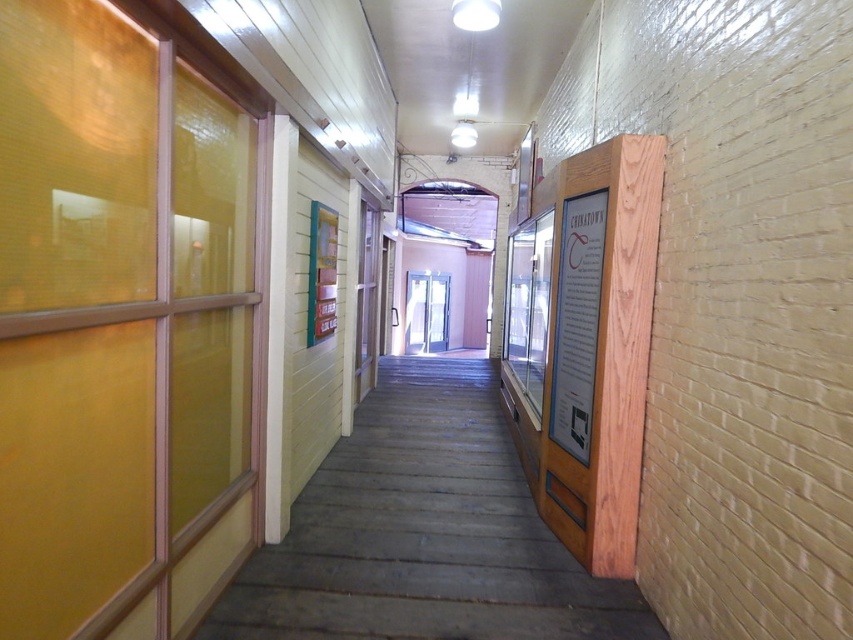
Is wooden stairs at center bigger than wooden door at center?

Actually, wooden stairs at center might be smaller than wooden door at center.

Measure the distance from wooden stairs at center to wooden door at center.

wooden stairs at center is 2.60 meters from wooden door at center.

Is point (413, 456) closer to camera compared to point (364, 230)?

Yes, it is.

Locate an element on the screen. This screenshot has width=853, height=640. wooden stairs at center is located at coordinates click(x=422, y=532).

Which is below, wooden door at center or white glossy door at center?

wooden door at center is below.

Does wooden door at center appear on the right side of white glossy door at center?

No, wooden door at center is not to the right of white glossy door at center.

You are a GUI agent. You are given a task and a screenshot of the screen. Output one action in this format:
    pyautogui.click(x=<x>, y=<y>)
    Task: Click on the wooden door at center
    
    Given the screenshot: What is the action you would take?
    pyautogui.click(x=366, y=300)

Which of these two, wooden stairs at center or white glossy door at center, stands shorter?

With less height is wooden stairs at center.

Is wooden stairs at center below white glossy door at center?

Yes, wooden stairs at center is below white glossy door at center.

I want to click on wooden stairs at center, so click(422, 532).